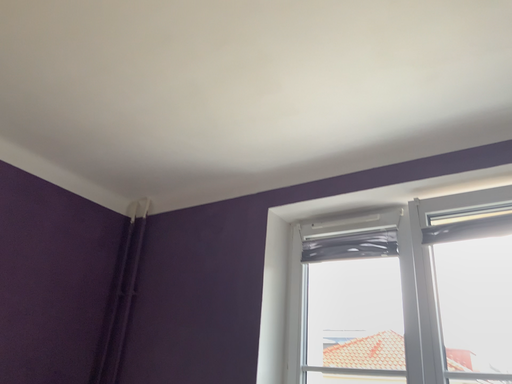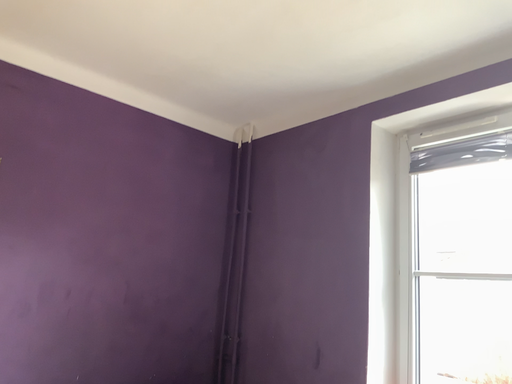
Question: How did the camera likely rotate when shooting the video?

Choices:
 (A) rotated upward
 (B) rotated downward

Answer: (B)